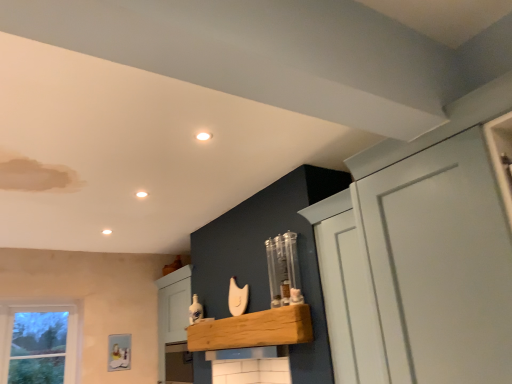
Question: From the image's perspective, is natural wood shelf at center over white matte cupboard at upper right?

Choices:
 (A) no
 (B) yes

Answer: (A)

Question: Does natural wood shelf at center come in front of white matte cupboard at upper right?

Choices:
 (A) yes
 (B) no

Answer: (B)

Question: Is natural wood shelf at center bigger than white matte cupboard at upper right?

Choices:
 (A) no
 (B) yes

Answer: (A)

Question: From the image's perspective, is natural wood shelf at center under white matte cupboard at upper right?

Choices:
 (A) no
 (B) yes

Answer: (B)

Question: Is natural wood shelf at center directly adjacent to white matte cupboard at upper right?

Choices:
 (A) yes
 (B) no

Answer: (B)

Question: Considering the relative sizes of natural wood shelf at center and white matte cupboard at upper right in the image provided, is natural wood shelf at center thinner than white matte cupboard at upper right?

Choices:
 (A) no
 (B) yes

Answer: (B)

Question: Does white matte cupboard at upper right have a greater height compared to natural wood shelf at center?

Choices:
 (A) no
 (B) yes

Answer: (B)

Question: Does white matte cupboard at upper right have a larger size compared to natural wood shelf at center?

Choices:
 (A) yes
 (B) no

Answer: (A)

Question: Is white matte cupboard at upper right shorter than natural wood shelf at center?

Choices:
 (A) no
 (B) yes

Answer: (A)

Question: Is white matte cupboard at upper right outside of natural wood shelf at center?

Choices:
 (A) yes
 (B) no

Answer: (A)

Question: Does white matte cupboard at upper right have a greater width compared to natural wood shelf at center?

Choices:
 (A) yes
 (B) no

Answer: (A)

Question: Is white matte cupboard at upper right next to natural wood shelf at center and touching it?

Choices:
 (A) no
 (B) yes

Answer: (A)

Question: Considering the positions of white matte cupboard at upper right and natural wood shelf at center in the image, is white matte cupboard at upper right bigger or smaller than natural wood shelf at center?

Choices:
 (A) small
 (B) big

Answer: (B)